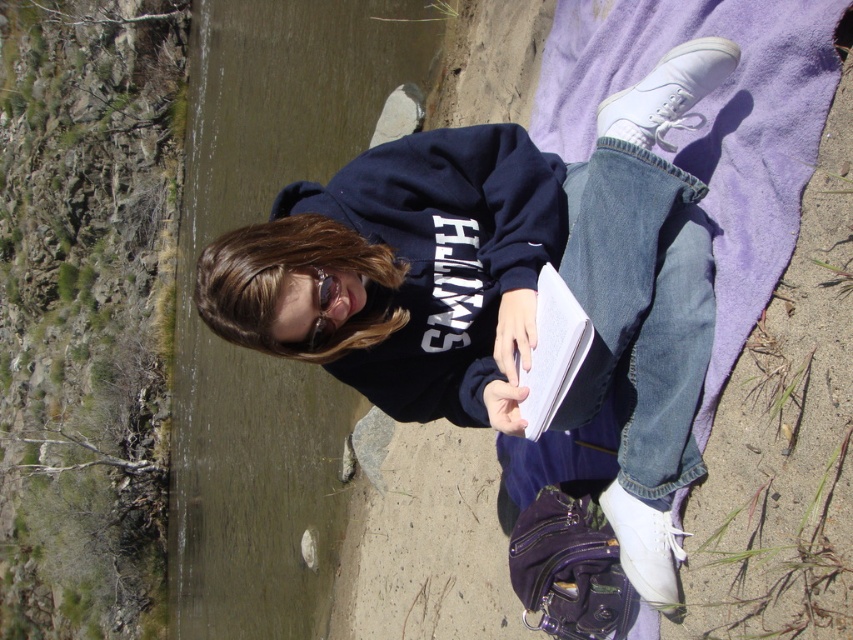
You are planning to take a photo of the scene. The matte black hoodie at center and the clear water at river left are both in view. Which object takes up more area in the photo?

The clear water at river left takes up more area in the photo because the matte black hoodie at center occupies less space than clear water at river left.

You are a photographer wanting to capture the black paper book at center and the clear water at river left in the same frame. Which object should you focus on first if you want to ensure both are in focus?

The clear water at river left is below the black paper book at center, so focusing on the black paper book at center first will help ensure both are in focus since it is closer to the camera.